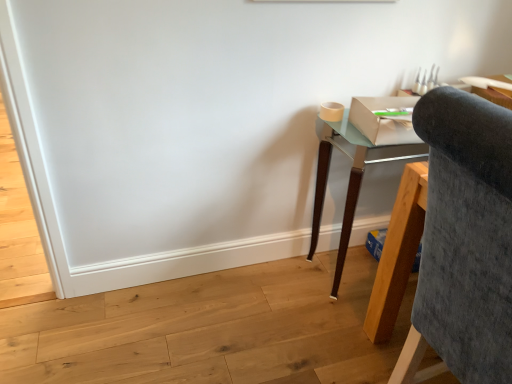
Question: Are velvet grey chair at right and teal glass desk at right far apart?

Choices:
 (A) no
 (B) yes

Answer: (A)

Question: Is velvet grey chair at right at the left side of teal glass desk at right?

Choices:
 (A) yes
 (B) no

Answer: (B)

Question: Can you confirm if velvet grey chair at right is thinner than teal glass desk at right?

Choices:
 (A) no
 (B) yes

Answer: (A)

Question: Can you confirm if velvet grey chair at right is taller than teal glass desk at right?

Choices:
 (A) no
 (B) yes

Answer: (B)

Question: Could you tell me if velvet grey chair at right is turned towards teal glass desk at right?

Choices:
 (A) yes
 (B) no

Answer: (B)

Question: From the image's perspective, is velvet grey chair at right above teal glass desk at right?

Choices:
 (A) yes
 (B) no

Answer: (B)

Question: Can you confirm if teal glass desk at right is taller than velvet grey chair at right?

Choices:
 (A) no
 (B) yes

Answer: (A)

Question: Can you confirm if teal glass desk at right is shorter than velvet grey chair at right?

Choices:
 (A) no
 (B) yes

Answer: (B)

Question: From a real-world perspective, is teal glass desk at right beneath velvet grey chair at right?

Choices:
 (A) yes
 (B) no

Answer: (A)

Question: Is velvet grey chair at right surrounded by teal glass desk at right?

Choices:
 (A) no
 (B) yes

Answer: (A)

Question: Considering the relative sizes of teal glass desk at right and velvet grey chair at right in the image provided, is teal glass desk at right wider than velvet grey chair at right?

Choices:
 (A) no
 (B) yes

Answer: (A)

Question: Is teal glass desk at right far away from velvet grey chair at right?

Choices:
 (A) yes
 (B) no

Answer: (B)

Question: From the image's perspective, relative to teal glass desk at right, is velvet grey chair at right above or below?

Choices:
 (A) above
 (B) below

Answer: (B)